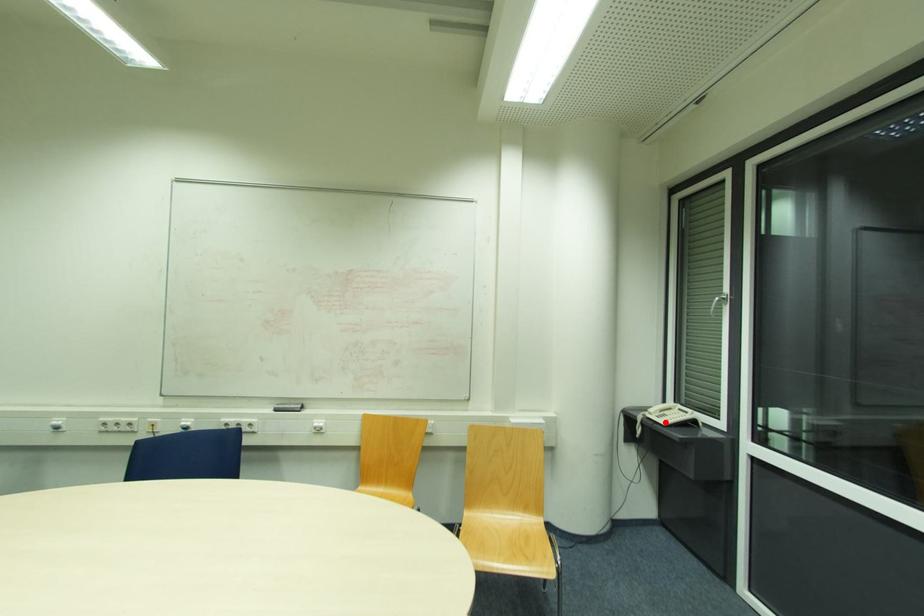
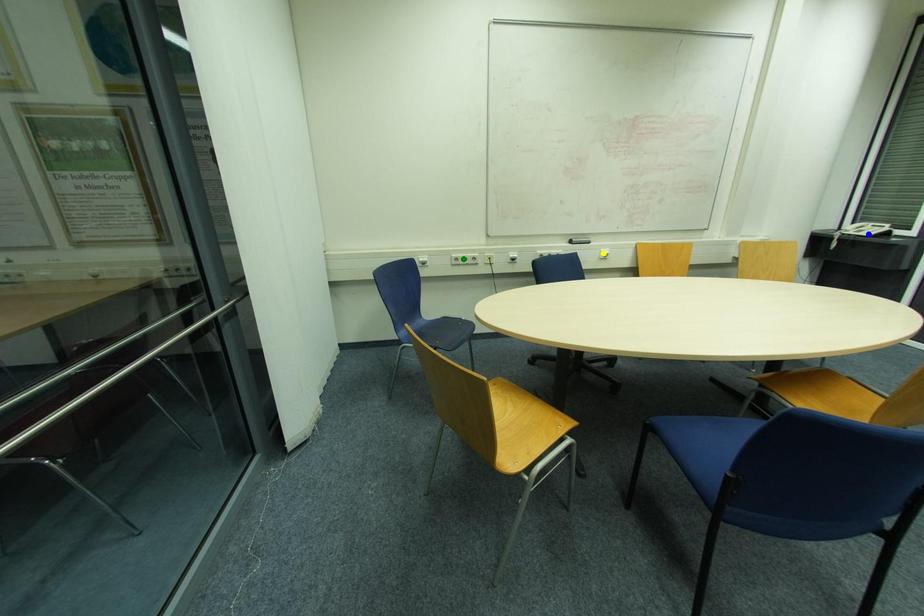
Question: I am providing you with two images of the same scene from different viewpoints. A red point is marked on the first image. You are given multiple points on the second image. In image 2, which mark is for the same physical point as the one in image 1?

Choices:
 (A) green point
 (B) blue point
 (C) yellow point

Answer: (B)